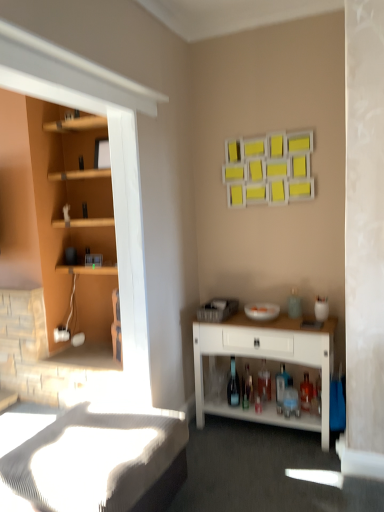
Question: From a real-world perspective, is translucent glass bottle at lower center, arranged as the first bottle when viewed from the right, beneath white textured bed frame at lower left?

Choices:
 (A) yes
 (B) no

Answer: (B)

Question: From the image's perspective, would you say translucent glass bottle at lower center, arranged as the first bottle when viewed from the right, is positioned over white textured bed frame at lower left?

Choices:
 (A) no
 (B) yes

Answer: (B)

Question: Is translucent glass bottle at lower center, arranged as the first bottle when viewed from the right, further to the viewer compared to white textured bed frame at lower left?

Choices:
 (A) yes
 (B) no

Answer: (A)

Question: Could you tell me if translucent glass bottle at lower center, which appears as the 1th bottle when viewed from the front, is turned towards white textured bed frame at lower left?

Choices:
 (A) yes
 (B) no

Answer: (B)

Question: Is translucent glass bottle at lower center, the 4th bottle when ordered from left to right, far away from white textured bed frame at lower left?

Choices:
 (A) no
 (B) yes

Answer: (B)

Question: Which is correct: transparent glass bottle at center, the 1th bottle positioned from the left, is inside white textured bed frame at lower left, or outside of it?

Choices:
 (A) inside
 (B) outside

Answer: (B)

Question: From the image's perspective, is transparent glass bottle at center, the second bottle in the front-to-back sequence, above or below white textured bed frame at lower left?

Choices:
 (A) above
 (B) below

Answer: (A)

Question: In terms of width, does transparent glass bottle at center, the second bottle in the front-to-back sequence, look wider or thinner when compared to white textured bed frame at lower left?

Choices:
 (A) wide
 (B) thin

Answer: (B)

Question: Looking at the image, does transparent glass bottle at center, the second bottle in the front-to-back sequence, seem bigger or smaller compared to white textured bed frame at lower left?

Choices:
 (A) small
 (B) big

Answer: (A)

Question: Is point (205, 340) positioned closer to the camera than point (284, 390)?

Choices:
 (A) farther
 (B) closer

Answer: (B)

Question: Looking at their shapes, would you say white wood desk at lower right is wider or thinner than translucent glass bottle at lower center, which appears as the 1th bottle when viewed from the front?

Choices:
 (A) wide
 (B) thin

Answer: (A)

Question: Is white wood desk at lower right inside the boundaries of translucent glass bottle at lower center, the 4th bottle when ordered from left to right, or outside?

Choices:
 (A) inside
 (B) outside

Answer: (B)

Question: In terms of height, does white wood desk at lower right look taller or shorter compared to translucent glass bottle at lower center, marked as the fourth bottle in a back-to-front arrangement?

Choices:
 (A) tall
 (B) short

Answer: (A)

Question: Is translucent glass bottle at lower center, which is the 4th bottle in front-to-back order, bigger or smaller than white wood desk at lower right?

Choices:
 (A) big
 (B) small

Answer: (B)

Question: From a real-world perspective, is translucent glass bottle at lower center, which is the 4th bottle in front-to-back order, physically located above or below white wood desk at lower right?

Choices:
 (A) below
 (B) above

Answer: (A)